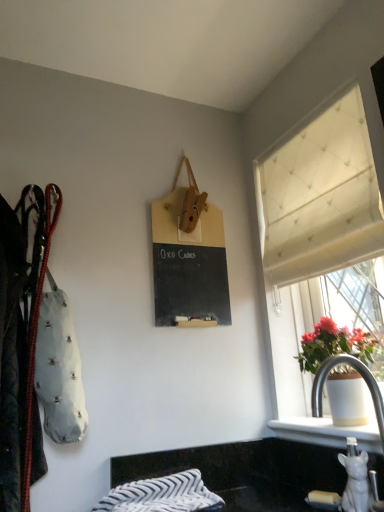
Question: Which is correct: white glossy sink at lower right is inside black granite countertop at lower center, or outside of it?

Choices:
 (A) outside
 (B) inside

Answer: (A)

Question: Considering the positions of white glossy sink at lower right and black granite countertop at lower center in the image, is white glossy sink at lower right bigger or smaller than black granite countertop at lower center?

Choices:
 (A) small
 (B) big

Answer: (A)

Question: Based on their relative distances, which object is farther from the white glossy sink at lower right?

Choices:
 (A) white ceramic pot at right
 (B) leather coat at left
 (C) black chalkboard at upper center
 (D) black granite countertop at lower center
 (E) striped cotton blanket at lower center

Answer: (B)

Question: Which object is positioned closest to the white glossy sink at lower right?

Choices:
 (A) striped cotton blanket at lower center
 (B) white ceramic pot at right
 (C) white textured curtain at upper right
 (D) leather coat at left
 (E) black chalkboard at upper center

Answer: (B)